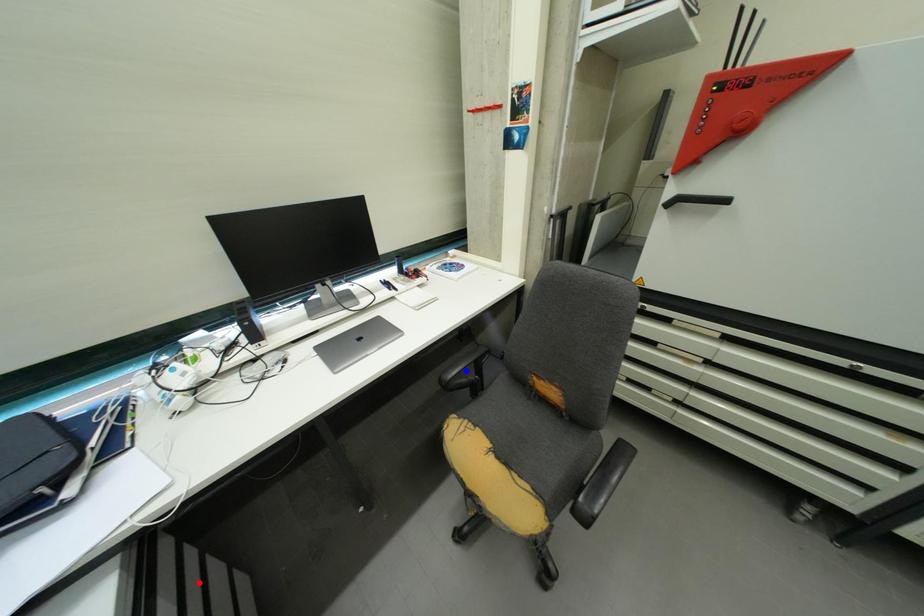
Question: Two points are marked on the image. Which point is closer to the camera?

Choices:
 (A) Blue point is closer.
 (B) Red point is closer.

Answer: (B)